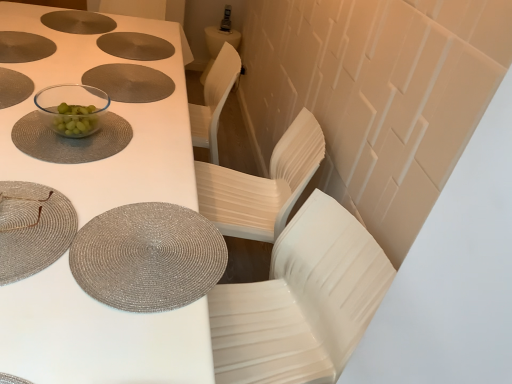
The width and height of the screenshot is (512, 384). In order to click on blank space situated above transparent glass bowl at center, which ranks as the 3th tableware in bottom-to-top order (from a real-world perspective) in this screenshot , I will do `click(77, 134)`.